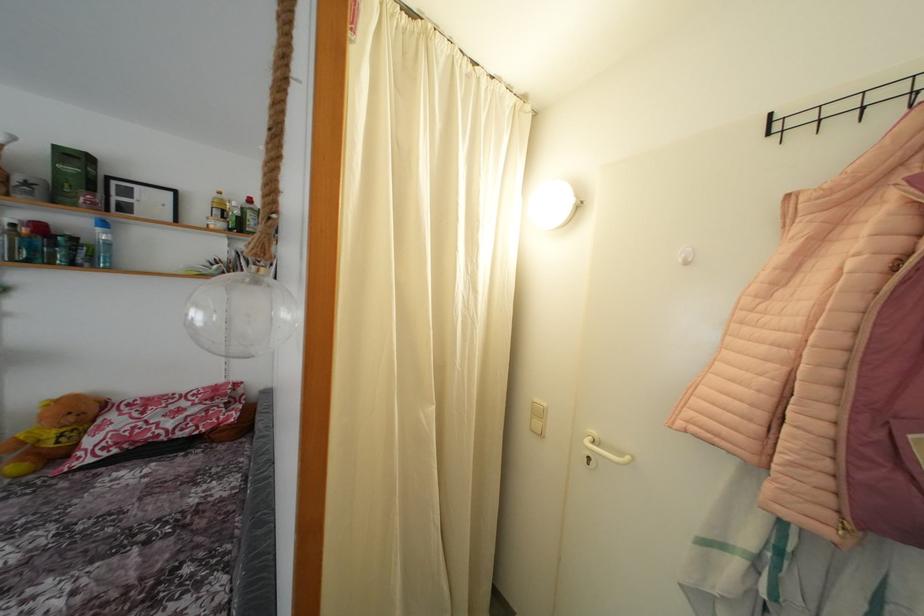
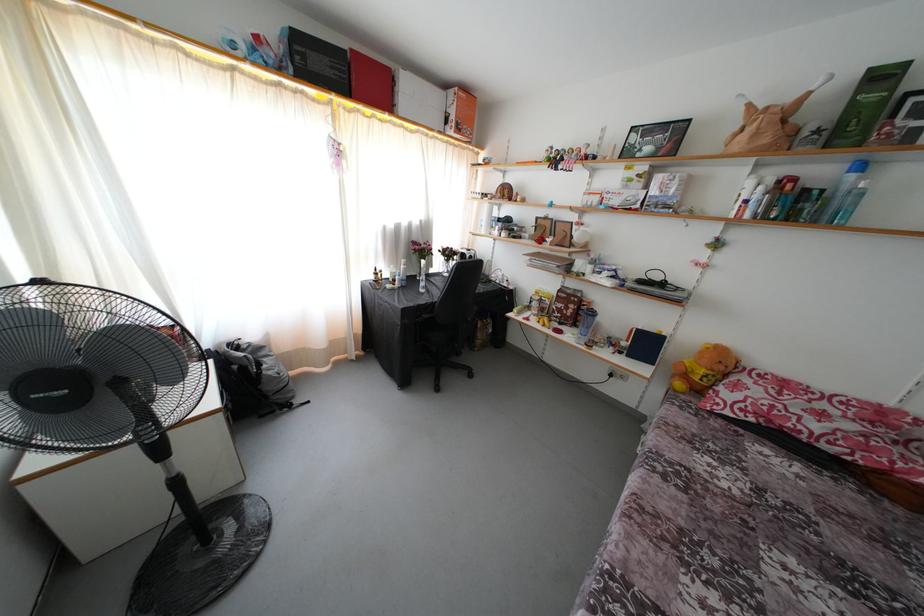
In the second image, find the point that corresponds to [77,424] in the first image.

(726, 373)